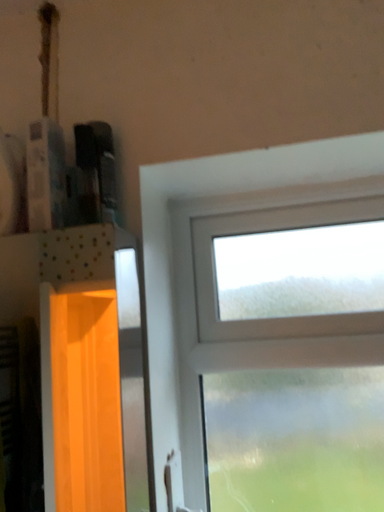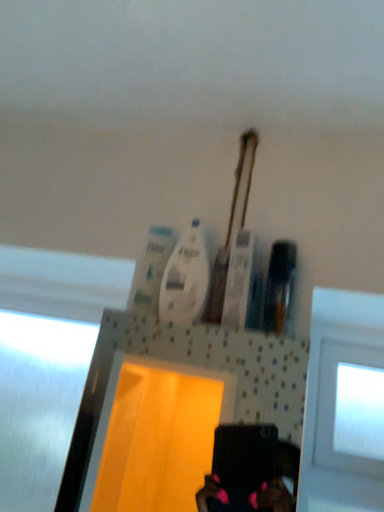
Question: How did the camera likely rotate when shooting the video?

Choices:
 (A) rotated upward
 (B) rotated downward

Answer: (A)